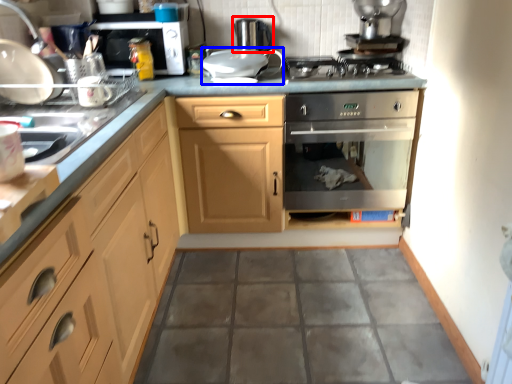
Question: Which of the following is the farthest to the observer, appliance (highlighted by a red box) or appliance (highlighted by a blue box)?

Choices:
 (A) appliance
 (B) appliance

Answer: (A)